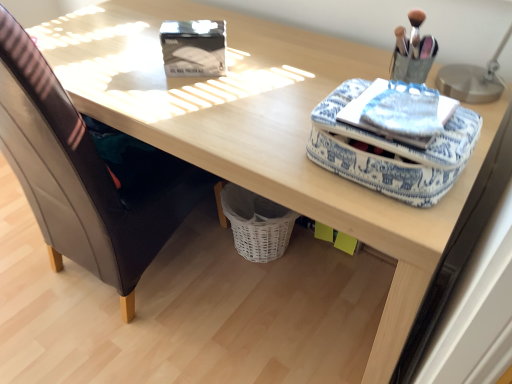
Find the location of a particular element. This screenshot has width=512, height=384. vacant area that is in front of matte black storage box at upper center is located at coordinates (194, 101).